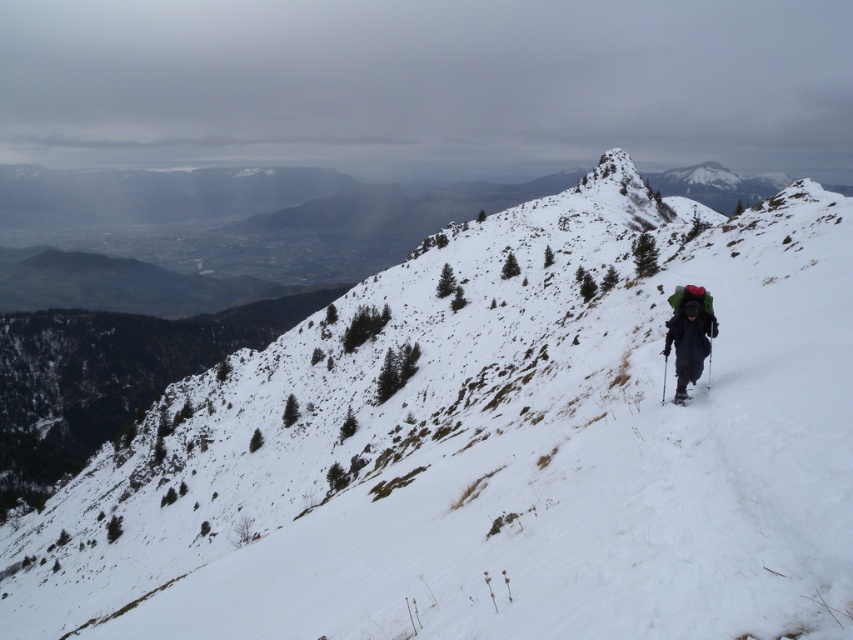
Who is more forward, (676, 380) or (686, 396)?

Positioned in front is point (686, 396).

Is dark blue fabric backpack at center-right further to the viewer compared to black matte ski at center-right?

Yes, dark blue fabric backpack at center-right is further from the viewer.

The height and width of the screenshot is (640, 853). In order to click on dark blue fabric backpack at center-right in this screenshot , I will do `click(689, 332)`.

In order to click on dark blue fabric backpack at center-right in this screenshot , I will do `click(689, 332)`.